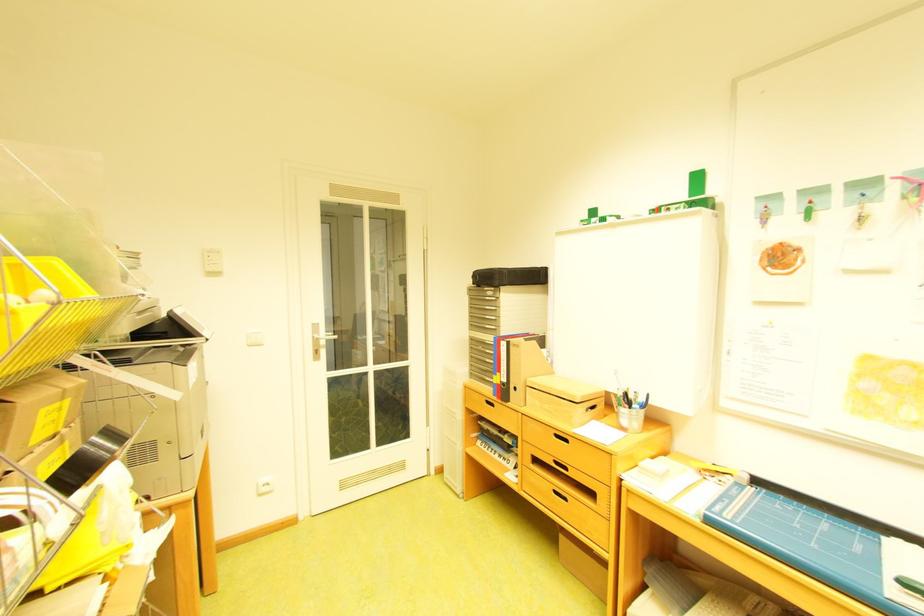
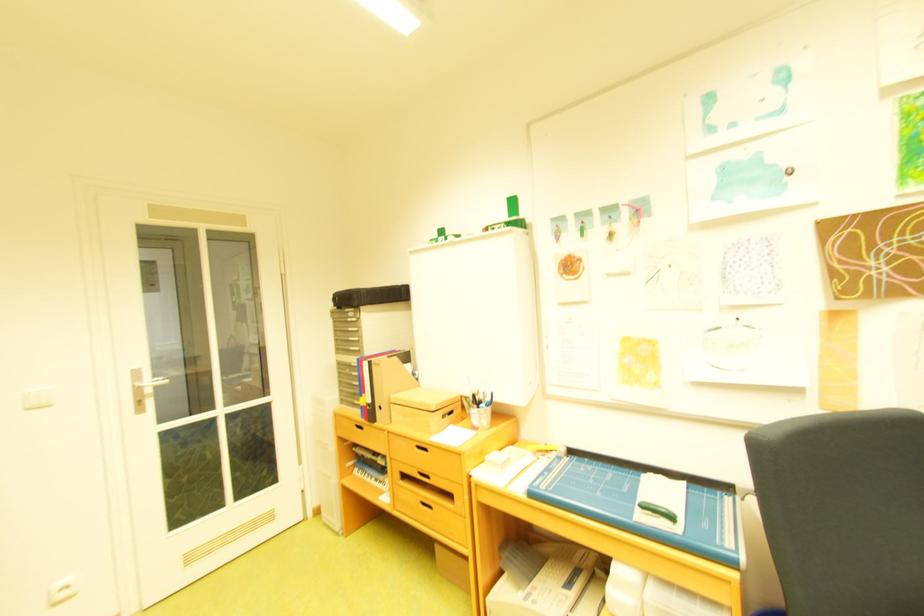
Question: How did the camera likely rotate?

Choices:
 (A) Left
 (B) Right
 (C) Up
 (D) Down

Answer: (B)